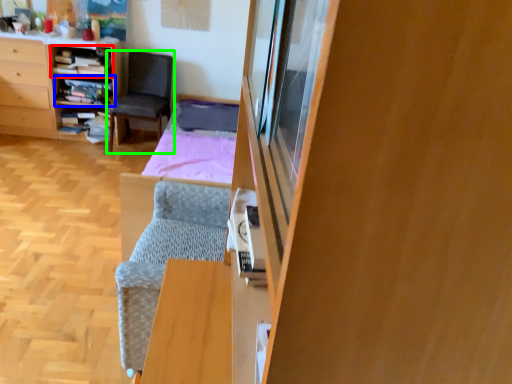
Question: Which object is positioned farthest from shelf (highlighted by a red box)? Select from shelf (highlighted by a blue box) and chair (highlighted by a green box).

Choices:
 (A) shelf
 (B) chair

Answer: (B)